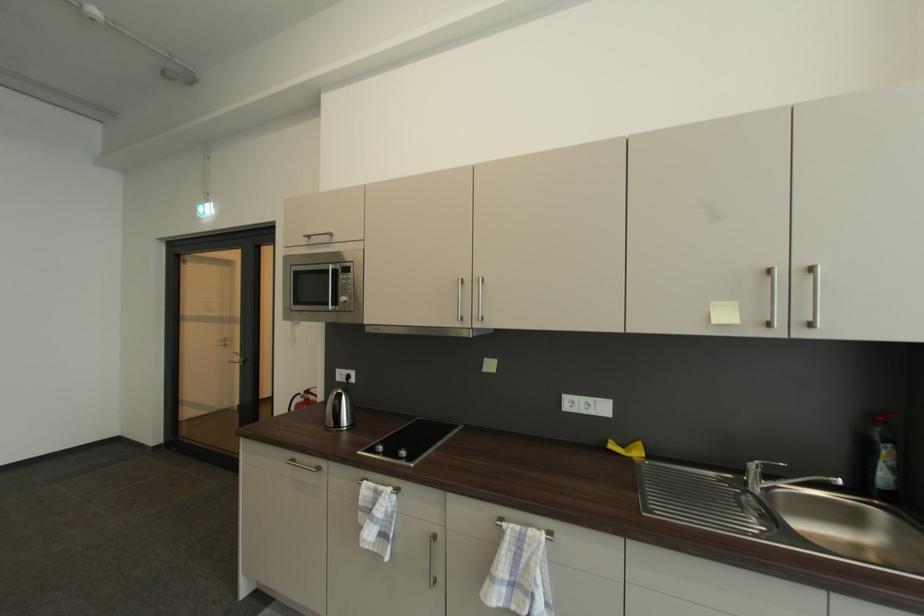
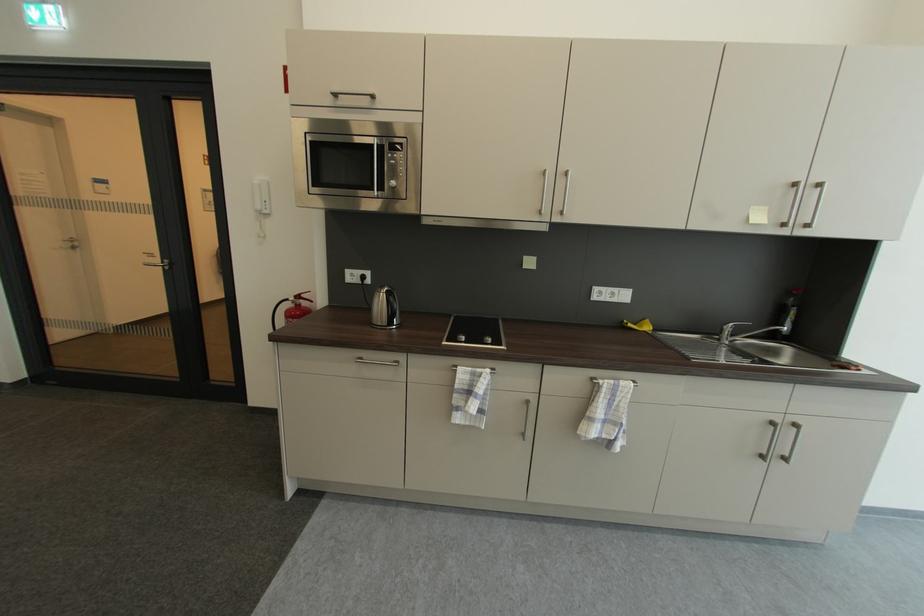
Where in the second image is the point corresponding to the point at 311,237 from the first image?

(337, 95)